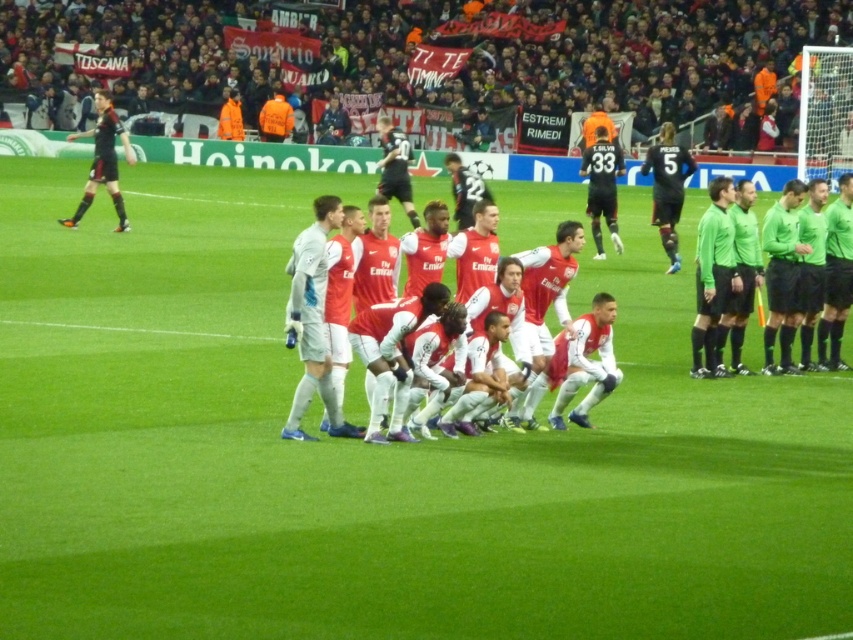
Which is behind, point (316, 317) or point (668, 273)?

Positioned behind is point (668, 273).

Can you confirm if white matte jersey at center is positioned to the left of black matte jersey at right?

Yes, white matte jersey at center is to the left of black matte jersey at right.

The width and height of the screenshot is (853, 640). What do you see at coordinates (312, 321) in the screenshot? I see `white matte jersey at center` at bounding box center [312, 321].

In order to click on white matte jersey at center in this screenshot , I will do `click(312, 321)`.

In the scene shown: Does matte black jersey at left appear on the left side of orange reflective jacket at upper center?

Indeed, matte black jersey at left is positioned on the left side of orange reflective jacket at upper center.

This screenshot has width=853, height=640. I want to click on matte black jersey at left, so [x=103, y=161].

What do you see at coordinates (712, 276) in the screenshot? I see `green jersey at right` at bounding box center [712, 276].

Does green jersey at right have a lesser height compared to black jersey at center?

No.

Between point (708, 284) and point (611, 184), which one is positioned behind?

The point (611, 184) is more distant.

You are a GUI agent. You are given a task and a screenshot of the screen. Output one action in this format:
    pyautogui.click(x=<x>, y=<y>)
    Task: Click on the green jersey at right
    This screenshot has width=853, height=640.
    Given the screenshot: What is the action you would take?
    pyautogui.click(x=712, y=276)